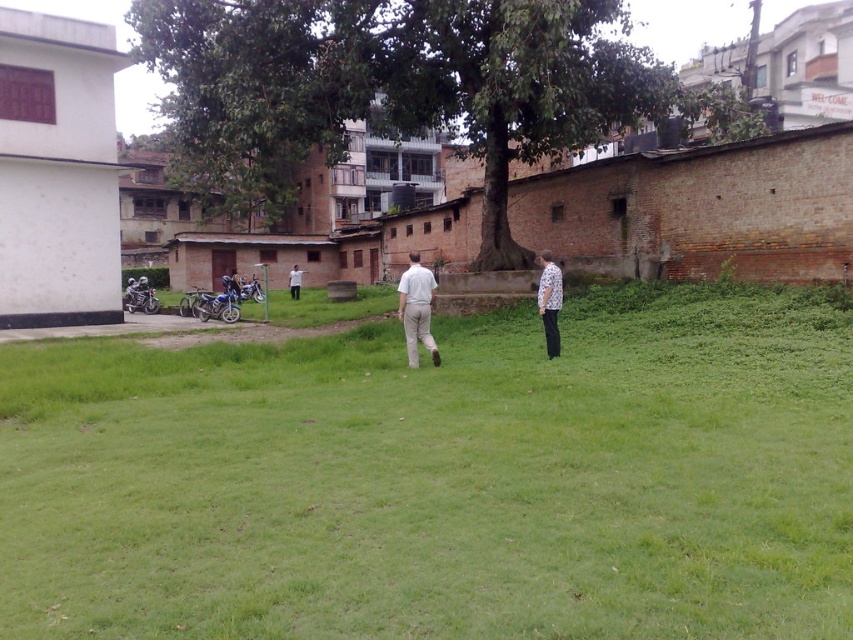
Question: Which of these objects is positioned farthest from the white shirt at center?

Choices:
 (A) green grass at center
 (B) white printed shirt at right

Answer: (A)

Question: Which of these objects is positioned farthest from the green grass at center?

Choices:
 (A) white printed shirt at right
 (B) white matte pants at center
 (C) white shirt at center

Answer: (C)

Question: Is the position of white matte pants at center less distant than that of white shirt at center?

Choices:
 (A) no
 (B) yes

Answer: (B)

Question: Is white matte pants at center above white shirt at center?

Choices:
 (A) no
 (B) yes

Answer: (A)

Question: Which point is farther to the camera?

Choices:
 (A) green grass at center
 (B) white matte pants at center

Answer: (B)

Question: Considering the relative positions of white matte pants at center and white printed shirt at right in the image provided, where is white matte pants at center located with respect to white printed shirt at right?

Choices:
 (A) right
 (B) left

Answer: (B)